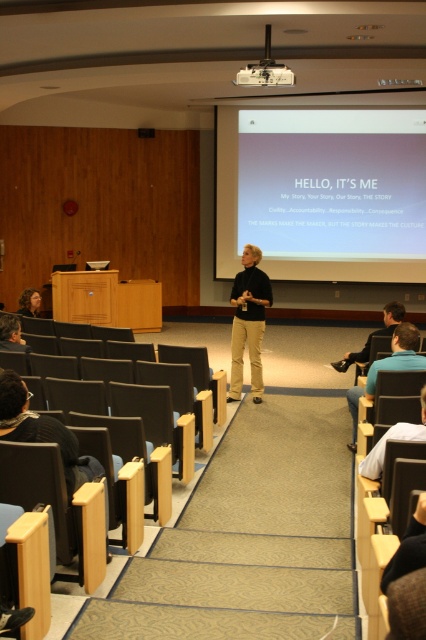
Question: Does matte white projector screen at upper center appear over dark brown hair at lower left?

Choices:
 (A) yes
 (B) no

Answer: (A)

Question: Which of the following is the farthest from the observer?

Choices:
 (A) blue fabric shirt at lower right
 (B) dark brown hair at lower left
 (C) matte white projector screen at upper center
 (D) blue shirt at right

Answer: (C)

Question: Which point appears farthest from the camera in this image?

Choices:
 (A) (278, 83)
 (B) (25, 308)
 (C) (155, 456)

Answer: (B)

Question: Can you confirm if wooden seat at lower left is bigger than black plastic chair at center?

Choices:
 (A) yes
 (B) no

Answer: (B)

Question: Does matte white projector screen at upper center lie behind white plastic projector at upper center?

Choices:
 (A) yes
 (B) no

Answer: (A)

Question: Estimate the real-world distances between objects in this image. Which object is farther from the blue fabric shirt at lower right?

Choices:
 (A) matte white projector screen at upper center
 (B) dark brown hair at lower left
 (C) black plastic chair at center
 (D) blue shirt at right

Answer: (A)